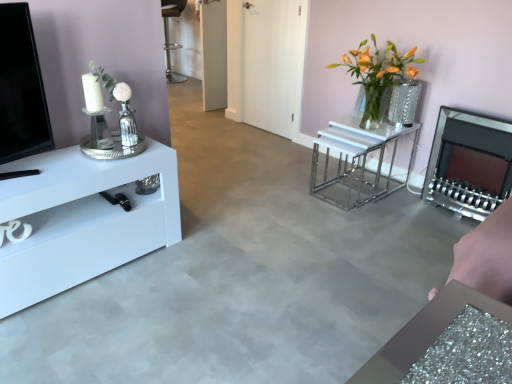
Identify the location of translucent glass vase at center right. click(377, 72).

The height and width of the screenshot is (384, 512). Describe the element at coordinates (168, 36) in the screenshot. I see `metallic silver stool at center` at that location.

You are a GUI agent. You are given a task and a screenshot of the screen. Output one action in this format:
    pyautogui.click(x=<x>, y=<y>)
    Task: Click on the white glossy door at center
    The image size is (512, 384).
    Given the screenshot: What is the action you would take?
    pyautogui.click(x=273, y=63)

Is matte black fireplace at right inside or outside of clear glass vase at center?

matte black fireplace at right lies outside clear glass vase at center.

Is matte black fireplace at right positioned far away from clear glass vase at center?

They are positioned close to each other.

Looking at their sizes, would you say matte black fireplace at right is wider or thinner than clear glass vase at center?

Clearly, matte black fireplace at right has more width compared to clear glass vase at center.

I want to click on fireplace directly beneath the clear glass vase at center (from a real-world perspective), so [x=469, y=163].

The width and height of the screenshot is (512, 384). What are the coordinates of `glass vase located above the metallic silver stool at center (from a real-world perspective)` in the screenshot? It's located at pos(384,103).

Are clear glass vase at center and metallic silver stool at center beside each other?

No.

Consider the image. Which object is thinner, clear glass vase at center or metallic silver stool at center?

With smaller width is clear glass vase at center.

Measure the distance from white glossy tv stand at left, acting as the first table starting from the left, to metallic silver stool at center.

white glossy tv stand at left, acting as the first table starting from the left, is 4.12 meters from metallic silver stool at center.

Is white glossy tv stand at left, acting as the first table starting from the left, to the left or to the right of metallic silver stool at center in the image?

white glossy tv stand at left, acting as the first table starting from the left, is to the right of metallic silver stool at center.

What's the angular difference between white glossy tv stand at left, which appears as the second table when viewed from the right, and metallic silver stool at center's facing directions?

white glossy tv stand at left, which appears as the second table when viewed from the right, and metallic silver stool at center are facing 179 degrees away from each other.

Does point (34, 251) come in front of point (172, 74)?

Yes, it is in front of point (172, 74).

From a real-world perspective, is white glossy tv stand at left, positioned as the 1th table in front-to-back order, beneath white glossy nesting tables at center, which is counted as the second table, starting from the left?

No, from a real-world perspective, white glossy tv stand at left, positioned as the 1th table in front-to-back order, is not below white glossy nesting tables at center, which is counted as the second table, starting from the left.

How many degrees apart are the facing directions of white glossy tv stand at left, which is counted as the second table, starting from the back, and white glossy nesting tables at center, arranged as the first table when viewed from the right?

90.7 degrees.

Where is `table on the left of white glossy nesting tables at center, arranged as the first table when viewed from the right`? table on the left of white glossy nesting tables at center, arranged as the first table when viewed from the right is located at coordinates (82, 220).

Can you confirm if white glossy tv stand at left, positioned as the 1th table in front-to-back order, is wider than white glossy nesting tables at center, arranged as the first table when viewed from the back?

No.

Is metallic silver stool at center positioned far away from white glossy nesting tables at center, which is counted as the second table, starting from the front?

metallic silver stool at center is positioned a significant distance from white glossy nesting tables at center, which is counted as the second table, starting from the front.

Considering the relative positions of metallic silver stool at center and white glossy nesting tables at center, which is counted as the second table, starting from the front, in the image provided, is metallic silver stool at center in front of white glossy nesting tables at center, which is counted as the second table, starting from the front,?

No, the depth of metallic silver stool at center is greater than that of white glossy nesting tables at center, which is counted as the second table, starting from the front.

Considering the sizes of objects metallic silver stool at center and white glossy nesting tables at center, which is counted as the second table, starting from the front, in the image provided, who is bigger, metallic silver stool at center or white glossy nesting tables at center, which is counted as the second table, starting from the front,?

metallic silver stool at center is bigger.

From a real-world perspective, between white glossy tv stand at left, which appears as the second table when viewed from the right, and clear glass vase at center, who is vertically lower?

In real-world perspective, white glossy tv stand at left, which appears as the second table when viewed from the right, is lower.

The height and width of the screenshot is (384, 512). Identify the location of glass vase positioned vertically above the white glossy tv stand at left, which is counted as the second table, starting from the back (from a real-world perspective). (384, 103).

Is clear glass vase at center surrounded by white glossy tv stand at left, acting as the first table starting from the left?

Definitely not — clear glass vase at center is not inside white glossy tv stand at left, acting as the first table starting from the left.

Between point (22, 278) and point (385, 92), which one is positioned behind?

The point (385, 92) is behind.

Based on the photo, is translucent glass vase at center right further to camera compared to white glossy door at center?

No, it is in front of white glossy door at center.

Consider the image. From their relative heights in the image, would you say translucent glass vase at center right is taller or shorter than white glossy door at center?

Considering their sizes, translucent glass vase at center right has less height than white glossy door at center.

In terms of size, does translucent glass vase at center right appear bigger or smaller than white glossy door at center?

translucent glass vase at center right is bigger than white glossy door at center.

From the image's perspective, is translucent glass vase at center right below white glossy door at center?

Correct, translucent glass vase at center right appears lower than white glossy door at center in the image.

This screenshot has height=384, width=512. Identify the location of glass vase above the matte black fireplace at right (from the image's perspective). (384, 103).

You are a GUI agent. You are given a task and a screenshot of the screen. Output one action in this format:
    pyautogui.click(x=<x>, y=<y>)
    Task: Click on the glass vase in front of the metallic silver stool at center
    
    Given the screenshot: What is the action you would take?
    pyautogui.click(x=384, y=103)

Based on their spatial positions, is translucent glass vase at center right or clear glass vase at center further from white glossy nesting tables at center, which is counted as the second table, starting from the left?

Among the two, clear glass vase at center is located further to white glossy nesting tables at center, which is counted as the second table, starting from the left.

Estimate the real-world distances between objects in this image. Which object is closer to metallic silver stool at center, white glossy nesting tables at center, arranged as the first table when viewed from the right, or translucent glass vase at center right?

white glossy nesting tables at center, arranged as the first table when viewed from the right.

When comparing their distances from white glossy tv stand at left, which is counted as the second table, starting from the back, does translucent glass vase at center right or matte black fireplace at right seem closer?

The object closer to white glossy tv stand at left, which is counted as the second table, starting from the back, is translucent glass vase at center right.

Considering their positions, is white glossy door at center positioned further to translucent glass vase at center right than clear glass vase at center?

Based on the image, white glossy door at center appears to be further to translucent glass vase at center right.

Which object lies nearer to the anchor point metallic silver stool at center, matte black fireplace at right or white glossy tv stand at left, positioned as the 1th table in front-to-back order?

Based on the image, matte black fireplace at right appears to be nearer to metallic silver stool at center.

Based on the photo, when comparing their distances from white glossy door at center, does white glossy nesting tables at center, arranged as the first table when viewed from the right, or white glossy tv stand at left, which appears as the second table when viewed from the right, seem further?

white glossy tv stand at left, which appears as the second table when viewed from the right, is positioned further to the anchor white glossy door at center.

From the image, which object appears to be nearer to translucent glass vase at center right, clear glass vase at center or white glossy nesting tables at center, which is counted as the second table, starting from the left?

clear glass vase at center lies closer to translucent glass vase at center right than the other object.

Looking at the image, which one is located further to translucent glass vase at center right, white glossy tv stand at left, which is counted as the second table, starting from the back, or metallic silver stool at center?

metallic silver stool at center is further to translucent glass vase at center right.

In order to click on table between matte black fireplace at right and metallic silver stool at center from front to back in this screenshot , I will do `click(358, 159)`.

At what (x,y) coordinates should I click in order to perform the action: click on glass vase between translucent glass vase at center right and white glossy door at center along the z-axis. Please return your answer as a coordinate pair (x, y). This screenshot has width=512, height=384. Looking at the image, I should click on (384, 103).

Find the location of a particular element. This screenshot has width=512, height=384. table located between white glossy tv stand at left, which is counted as the second table, starting from the back, and metallic silver stool at center in the depth direction is located at coordinates (358, 159).

Locate an element on the screen. Image resolution: width=512 pixels, height=384 pixels. table between white glossy tv stand at left, acting as the first table starting from the left, and clear glass vase at center, in the horizontal direction is located at coordinates (358, 159).